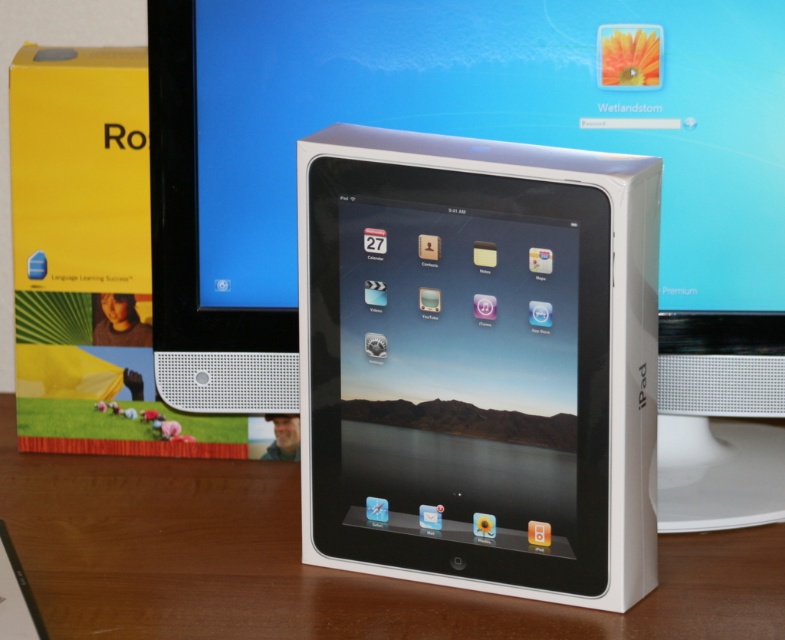
Question: Does white glossy tablet at center lie in front of wooden table at center?

Choices:
 (A) no
 (B) yes

Answer: (B)

Question: Does white glossy tablet at center come in front of wooden table at center?

Choices:
 (A) no
 (B) yes

Answer: (B)

Question: Which point is farther from the camera taking this photo?

Choices:
 (A) (559, 196)
 (B) (119, 596)

Answer: (B)

Question: Considering the relative positions of white glossy tablet at center and wooden table at center in the image provided, where is white glossy tablet at center located with respect to wooden table at center?

Choices:
 (A) right
 (B) left

Answer: (A)

Question: Which point appears farthest from the camera in this image?

Choices:
 (A) (279, 515)
 (B) (411, 342)

Answer: (A)

Question: Which object appears closest to the camera in this image?

Choices:
 (A) white glossy tablet at center
 (B) wooden table at center

Answer: (A)